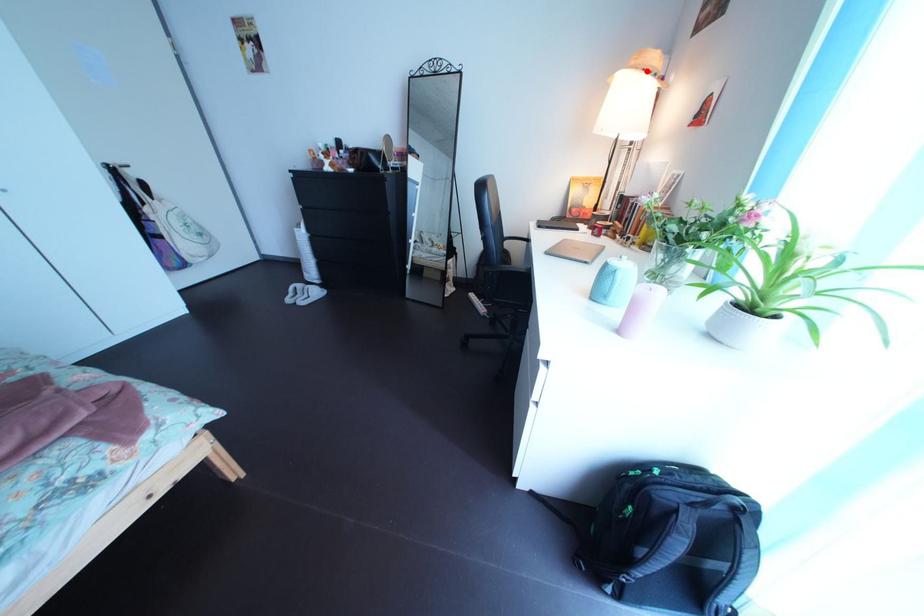
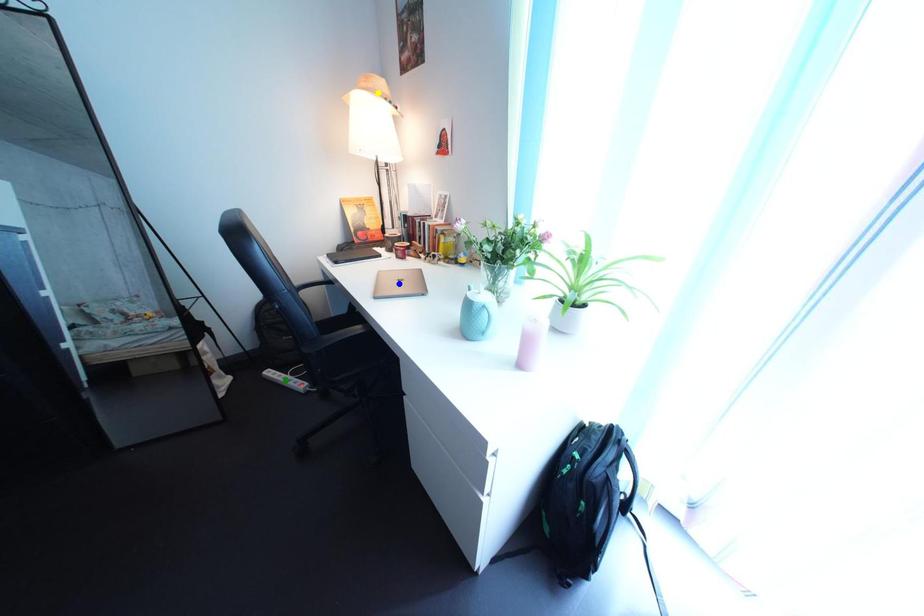
Question: I am providing you with two images of the same scene from different viewpoints. A red point is marked on the first image. You are given multiple points on the second image. Which point in image 2 is actually the same real-world point as the red point in image 1?

Choices:
 (A) green point
 (B) yellow point
 (C) blue point

Answer: (B)